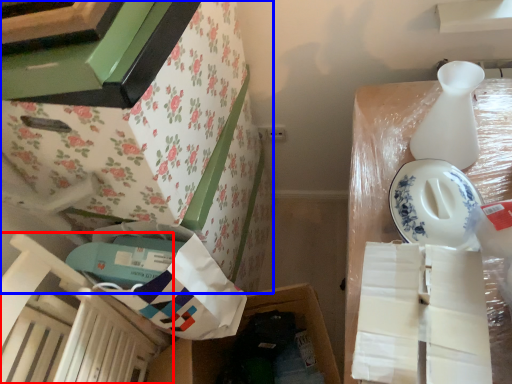
Question: Which of the following is the closest to the observer, chair (highlighted by a red box) or furniture (highlighted by a blue box)?

Choices:
 (A) chair
 (B) furniture

Answer: (A)